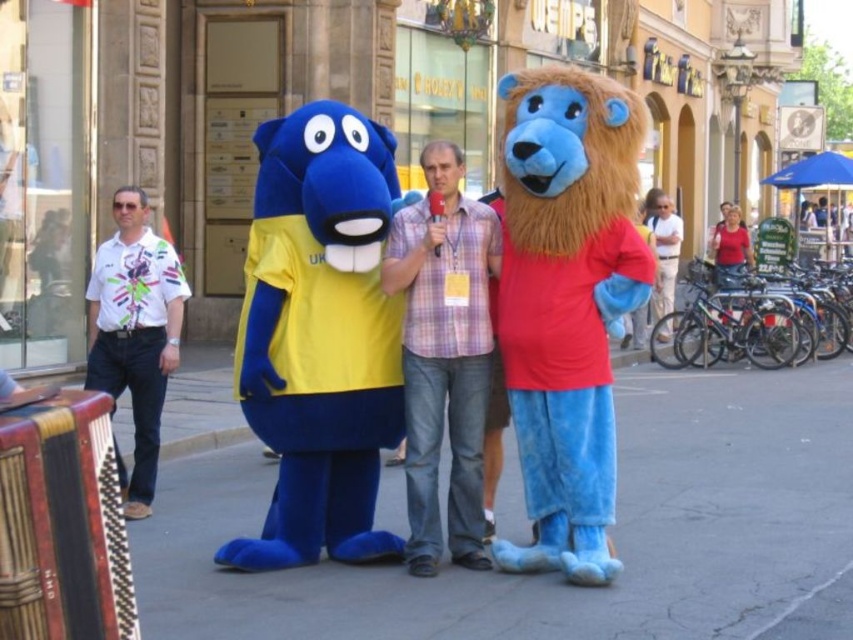
Question: Which of the following is the farthest from the observer?

Choices:
 (A) blue plush bear at center
 (B) blue plush at center

Answer: (A)

Question: Observing the image, what is the correct spatial positioning of blue plush bear at center in reference to plaid cotton shirt at center?

Choices:
 (A) right
 (B) left

Answer: (B)

Question: Among these objects, which one is farthest from the camera?

Choices:
 (A) blue plush at center
 (B) plaid cotton shirt at center
 (C) blue plush bear at center
 (D) white printed shirt at left

Answer: (D)

Question: Which of these objects is positioned closest to the blue plush bear at center?

Choices:
 (A) white printed shirt at left
 (B) blue plush at center

Answer: (A)

Question: Can you confirm if plaid cotton shirt at center is positioned to the right of white printed shirt at left?

Choices:
 (A) yes
 (B) no

Answer: (A)

Question: Where is fuzzy blue lion at center located in relation to plaid cotton shirt at center in the image?

Choices:
 (A) left
 (B) right

Answer: (B)